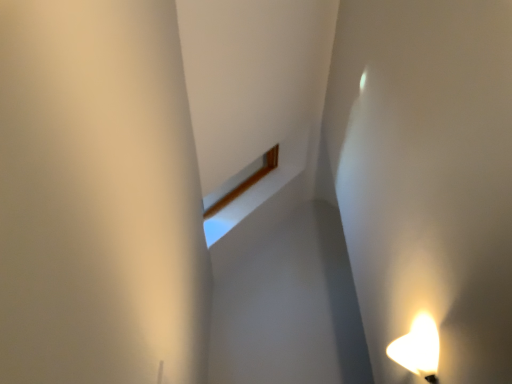
Question: Should I look upward or downward to see white glossy lamp at lower right?

Choices:
 (A) up
 (B) down

Answer: (B)